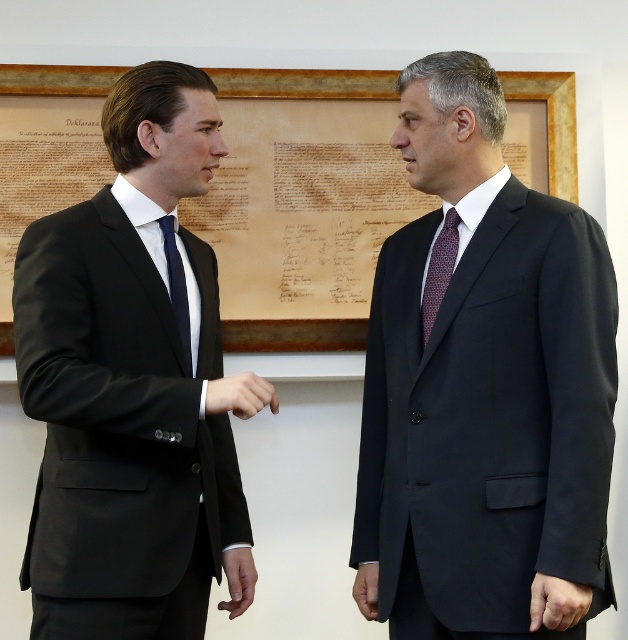
Between black smooth suit at lower left and black smooth hand at center, which one appears on the left side from the viewer's perspective?

From the viewer's perspective, black smooth suit at lower left appears more on the left side.

Is black smooth suit at lower left below black smooth hand at center?

Incorrect, black smooth suit at lower left is not positioned below black smooth hand at center.

Identify the location of black smooth suit at lower left. (239, 579).

Which is more to the right, matte black suit at right or matte black hand at lower right?

matte black hand at lower right is more to the right.

Describe the element at coordinates (484, 381) in the screenshot. I see `matte black suit at right` at that location.

Where is `matte black suit at right`? The image size is (628, 640). matte black suit at right is located at coordinates (484, 381).

You are a GUI agent. You are given a task and a screenshot of the screen. Output one action in this format:
    pyautogui.click(x=<x>, y=<y>)
    Task: Click on the matte black suit at right
    This screenshot has height=640, width=628.
    Given the screenshot: What is the action you would take?
    pyautogui.click(x=484, y=381)

Describe the element at coordinates (484, 381) in the screenshot. I see `matte black suit at right` at that location.

Who is more distant from viewer, (x=555, y=388) or (x=46, y=600)?

The point (x=46, y=600) is more distant.

At what (x,y) coordinates should I click in order to perform the action: click on matte black suit at right. Please return your answer as a coordinate pair (x, y). Image resolution: width=628 pixels, height=640 pixels. Looking at the image, I should click on (484, 381).